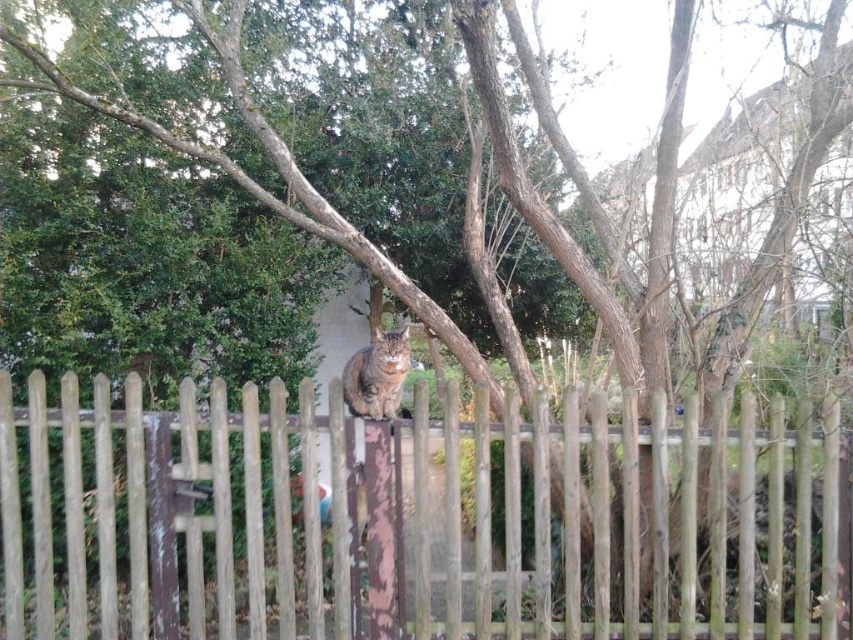
Question: Is weathered wood fence at center positioned before tabby fur cat at center?

Choices:
 (A) no
 (B) yes

Answer: (B)

Question: Which point is closer to the camera?

Choices:
 (A) tabby fur cat at center
 (B) weathered wood fence at center

Answer: (B)

Question: From the image, what is the correct spatial relationship of weathered wood fence at center in relation to tabby fur cat at center?

Choices:
 (A) above
 (B) below

Answer: (B)

Question: Does weathered wood fence at center have a larger size compared to tabby fur cat at center?

Choices:
 (A) yes
 (B) no

Answer: (A)